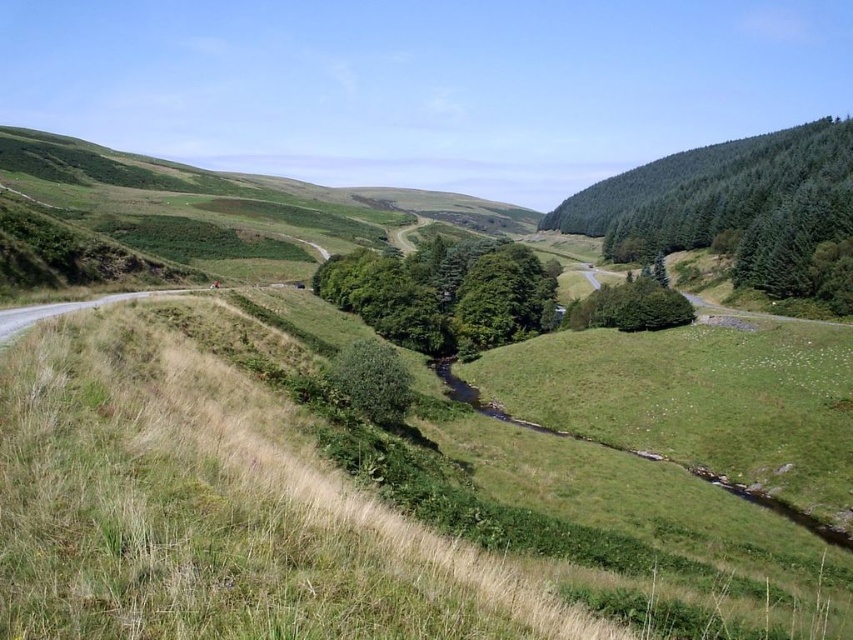
You are a hiker planning to walk from the road on the left to the green leafy tree at center. Do you need to go around the green coniferous forest at upper right to reach it?

The green coniferous forest at upper right is above the green leafy tree at center, so you don not need to go around the forest to reach the green leafy tree at center.